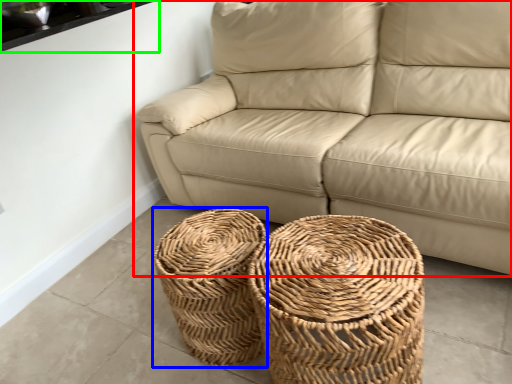
Question: Which is nearer to the studio couch (highlighted by a red box)? basket (highlighted by a blue box) or window sill (highlighted by a green box).

Choices:
 (A) basket
 (B) window sill

Answer: (A)